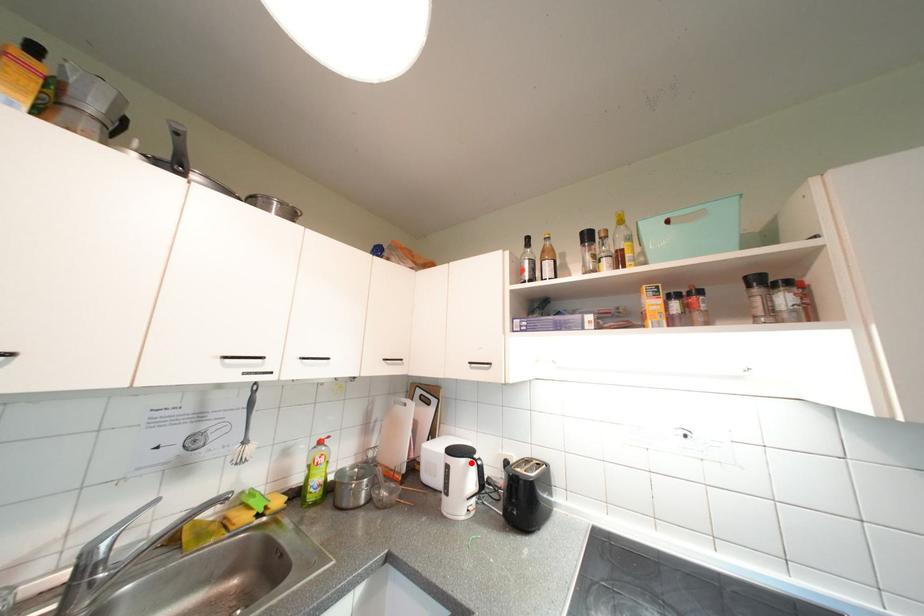
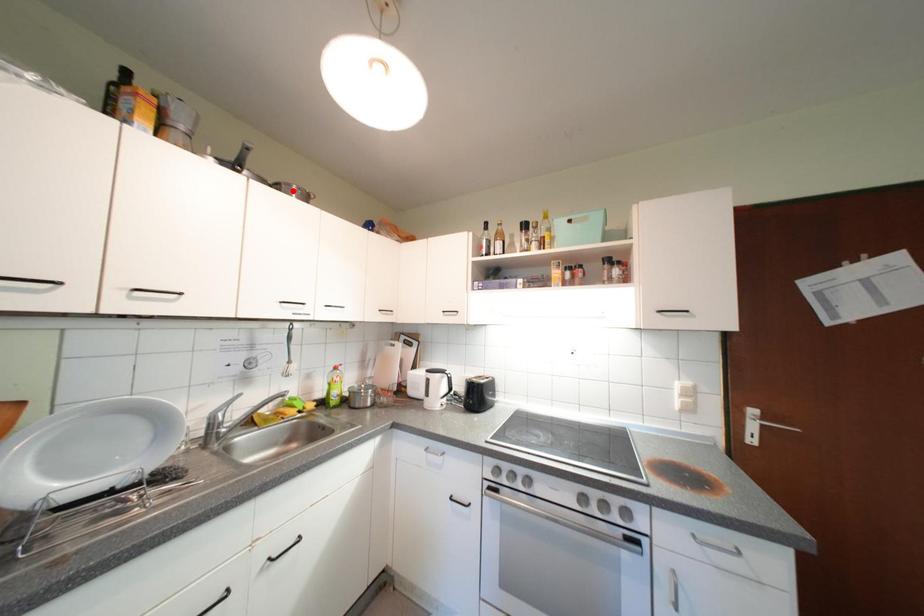
I am providing you with two images of the same scene from different viewpoints. A red point is marked on the first image and another point is marked on the second image. Is the marked point in image1 the same physical position as the marked point in image2?

No